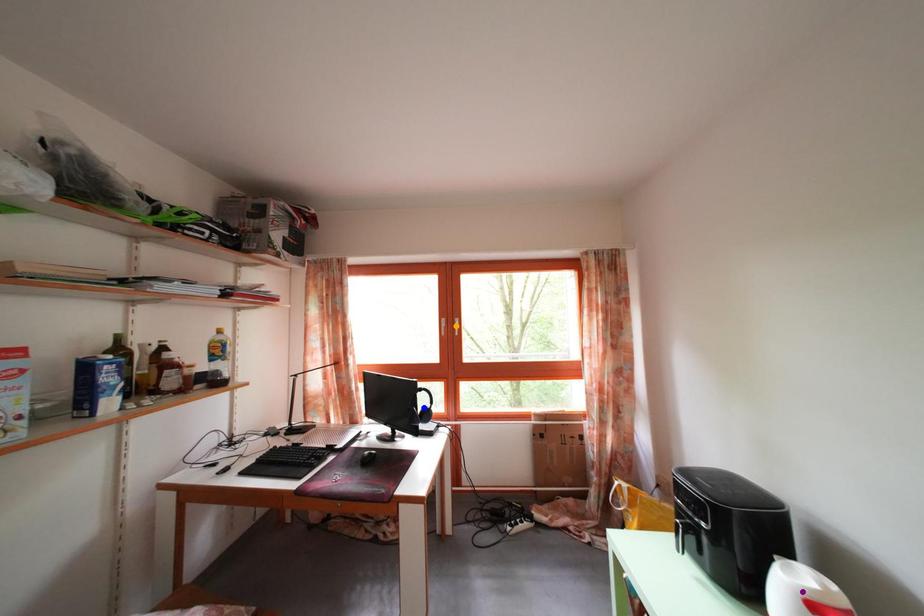
Order these from nearest to farthest:
- purple point
- orange point
- blue point

purple point → blue point → orange point